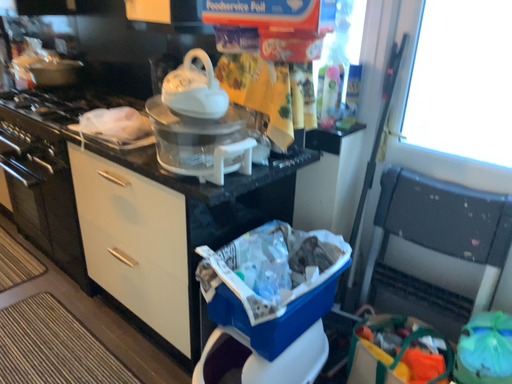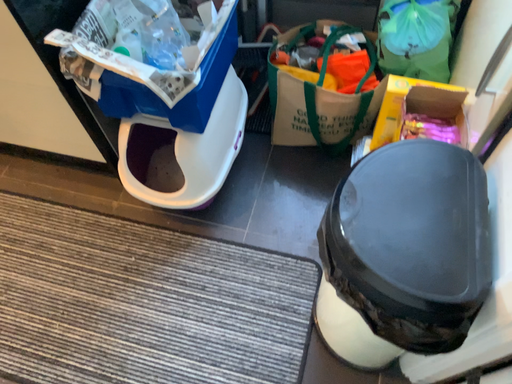
Question: Which way did the camera rotate in the video?

Choices:
 (A) rotated upward
 (B) rotated downward

Answer: (B)